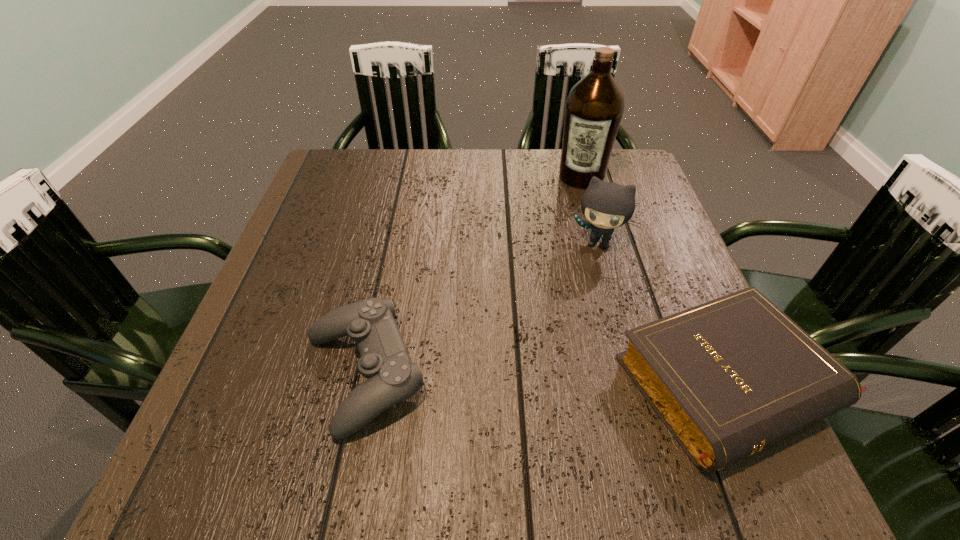
Locate an element on the screen. The height and width of the screenshot is (540, 960). vacant spot on the desktop that is between the leftmost object and the Bible and is positioned on the label of the tallest object is located at coordinates (517, 377).

At what (x,y) coordinates should I click in order to perform the action: click on vacant space on the desktop that is between the leftmost object and the Bible and is positioned on the front-facing side of the kitten. Please return your answer as a coordinate pair (x, y). This screenshot has width=960, height=540. Looking at the image, I should click on (550, 379).